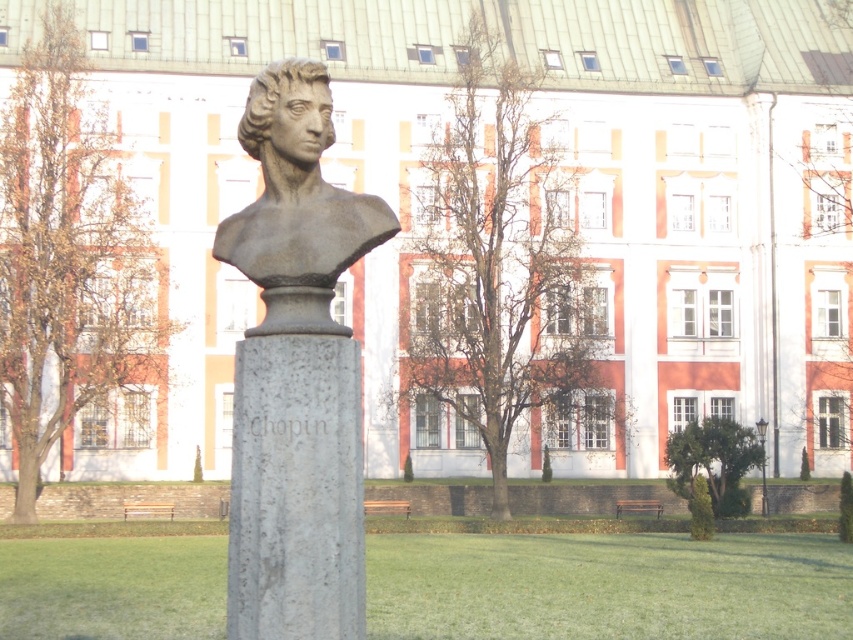
Does gray stone column at center appear under matte stone bust at center?

Indeed, gray stone column at center is positioned under matte stone bust at center.

Is point (293, 528) closer to viewer compared to point (256, 92)?

That is True.

Where is `gray stone column at center`? The height and width of the screenshot is (640, 853). gray stone column at center is located at coordinates (296, 490).

Is point (306, 492) in front of point (267, 74)?

Yes, it is in front of point (267, 74).

This screenshot has height=640, width=853. What do you see at coordinates (296, 374) in the screenshot?
I see `gray stone bust at center` at bounding box center [296, 374].

The image size is (853, 640). I want to click on gray stone bust at center, so click(296, 374).

Who is positioned more to the right, bronze statue at center or matte stone bust at center?

Positioned to the right is matte stone bust at center.

From the picture: Can you confirm if bronze statue at center is thinner than matte stone bust at center?

In fact, bronze statue at center might be wider than matte stone bust at center.

Identify the location of bronze statue at center. point(296,188).